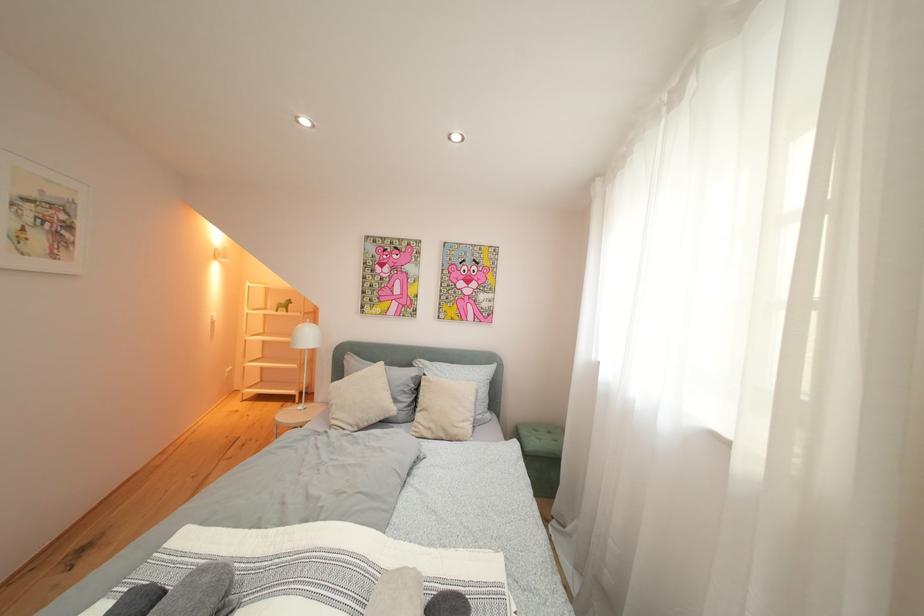
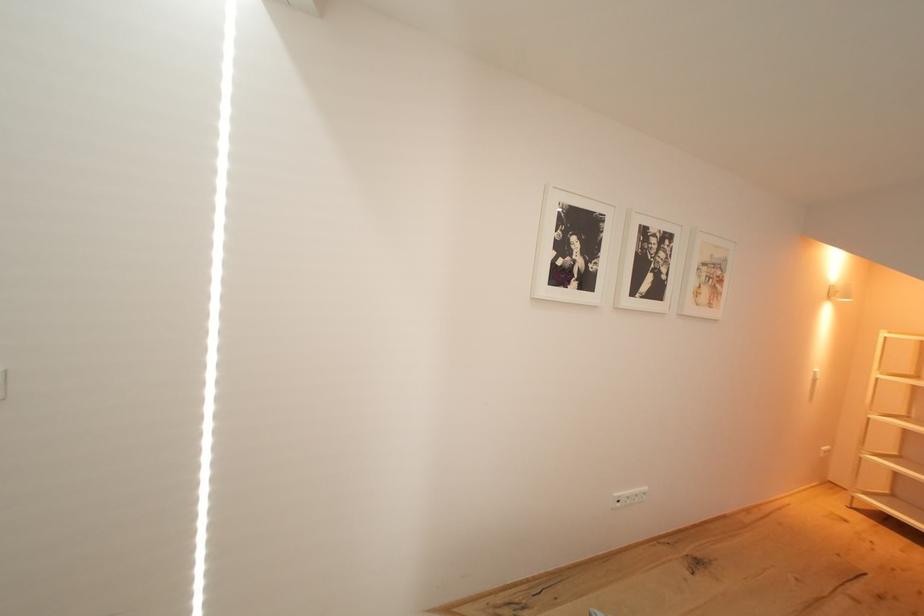
Question: How did the camera likely rotate?

Choices:
 (A) Left
 (B) Right
 (C) Up
 (D) Down

Answer: (A)